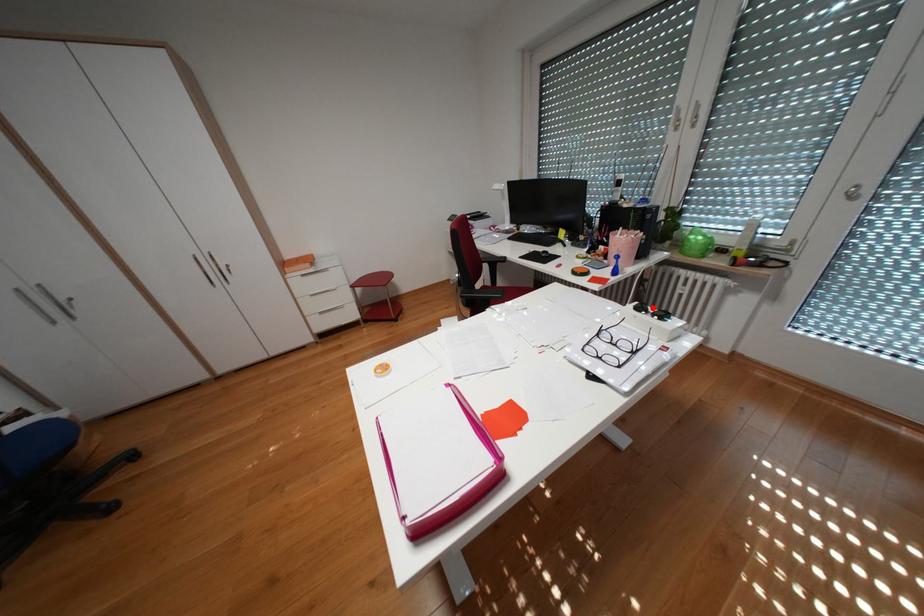
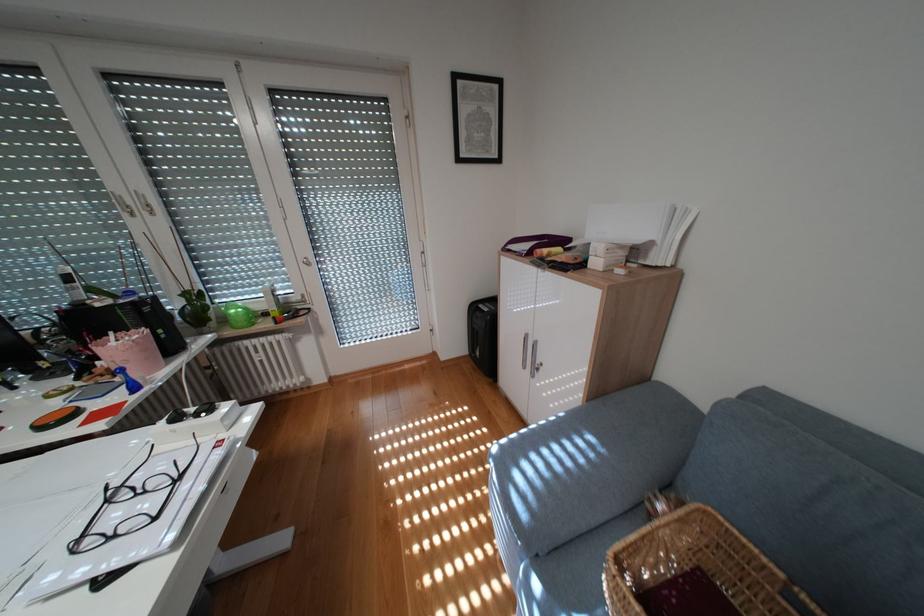
Find the pixel in the second image that matches the highlighted location in the first image.

(188, 418)